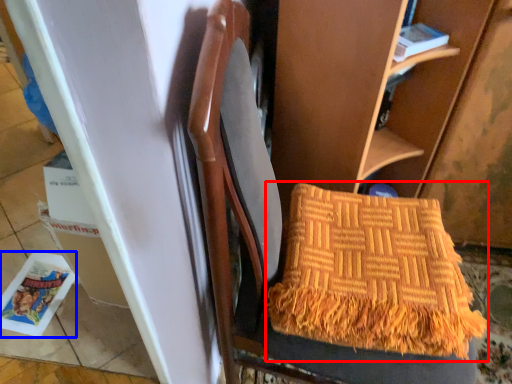
Question: Which point is further to the camera, blanket (highlighted by a red box) or magazine (highlighted by a blue box)?

Choices:
 (A) blanket
 (B) magazine

Answer: (B)